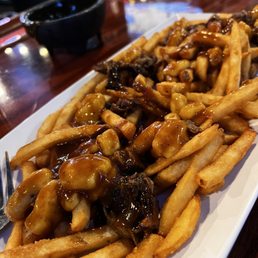
Where is `plate`? This screenshot has height=258, width=258. plate is located at coordinates (54, 105).